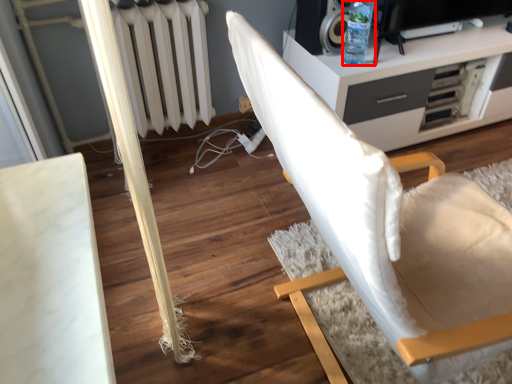
Question: Considering the relative positions of bottle (annotated by the red box) and chair in the image provided, where is bottle (annotated by the red box) located with respect to the staircase?

Choices:
 (A) right
 (B) left

Answer: (A)